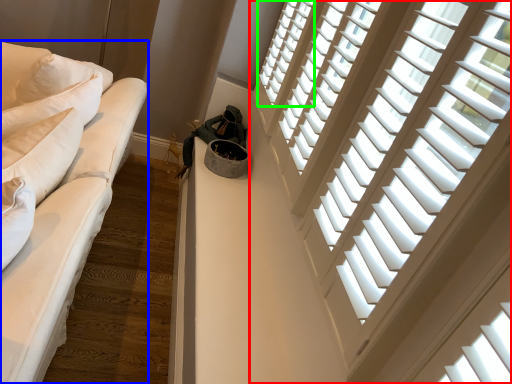
Question: Which is farther away from window (highlighted by a red box)? studio couch (highlighted by a blue box) or window (highlighted by a green box)?

Choices:
 (A) studio couch
 (B) window

Answer: (B)